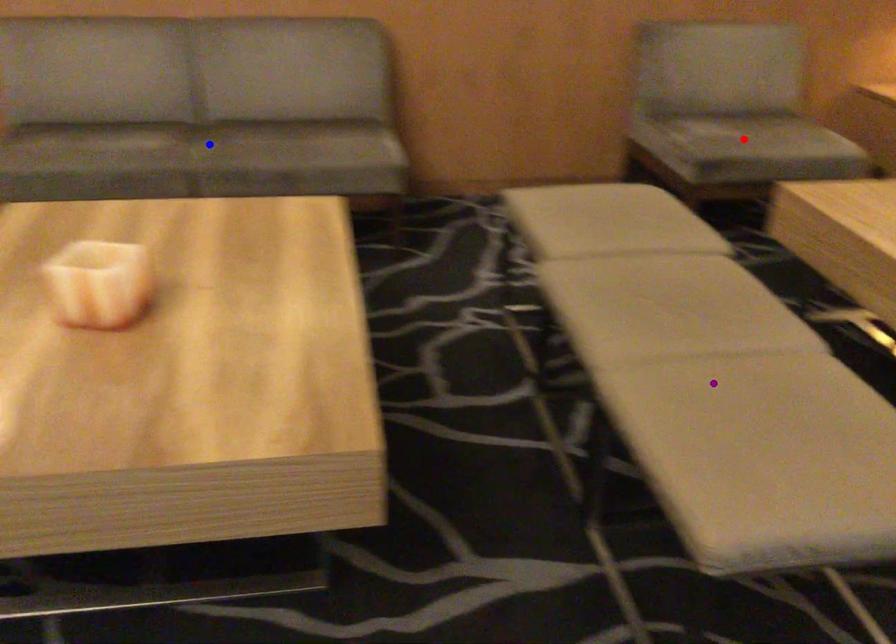
Order these from nearest to farthest:
1. purple point
2. blue point
3. red point

purple point, blue point, red point